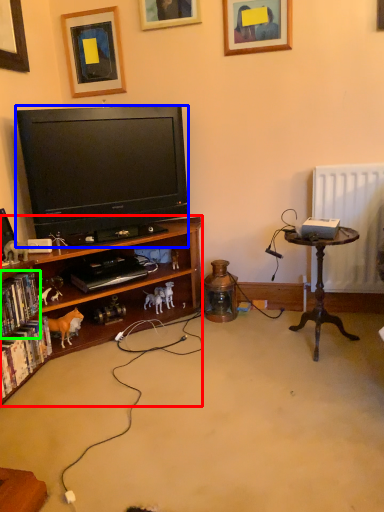
Question: Considering the real-world distances, which object is farthest from bookcase (highlighted by a red box)? television (highlighted by a blue box) or book (highlighted by a green box)?

Choices:
 (A) television
 (B) book

Answer: (B)